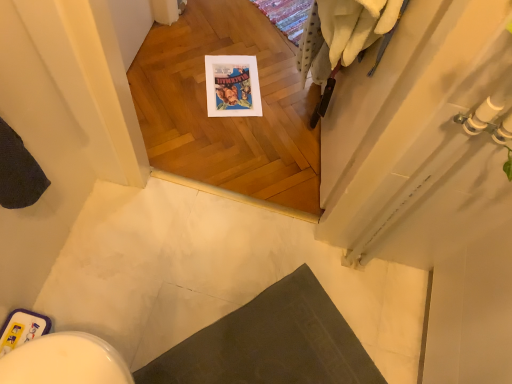
Where is `white fluffy gloves at upper right`? The image size is (512, 384). white fluffy gloves at upper right is located at coordinates (341, 33).

What is the approximate height of white fluffy gloves at upper right?

white fluffy gloves at upper right is 17.99 inches in height.

Measure the distance between white fluffy gloves at upper right and camera.

white fluffy gloves at upper right and camera are 32.07 inches apart from each other.

Describe the element at coordinates (341, 33) in the screenshot. I see `white fluffy gloves at upper right` at that location.

You are a GUI agent. You are given a task and a screenshot of the screen. Output one action in this format:
    pyautogui.click(x=<x>, y=<y>)
    Task: Click on the white fluffy gloves at upper right
    This screenshot has width=512, height=384.
    Given the screenshot: What is the action you would take?
    pyautogui.click(x=341, y=33)